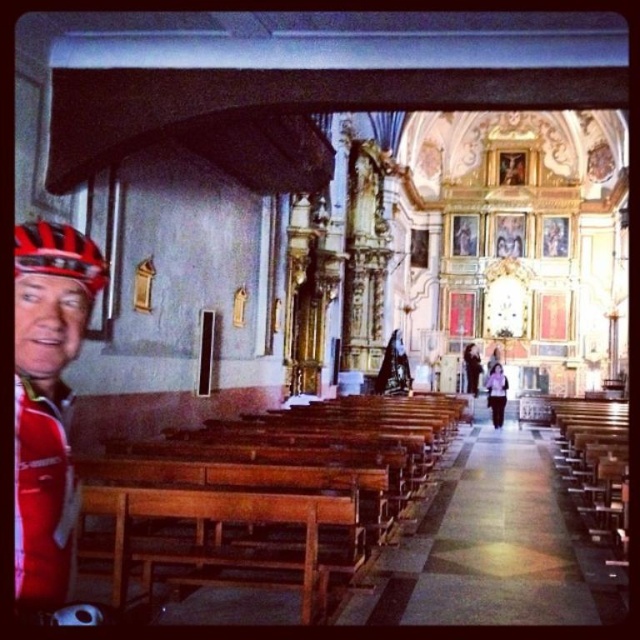
Question: Is wooden pews at center positioned at the back of red matte helmet at left?

Choices:
 (A) no
 (B) yes

Answer: (B)

Question: Observing the image, what is the correct spatial positioning of red matte helmet at left in reference to shiny red helmet at left?

Choices:
 (A) right
 (B) left

Answer: (B)

Question: Which object is the farthest from the red matte helmet at left?

Choices:
 (A) wooden pews at center
 (B) shiny red helmet at left
 (C) purple fabric at center
 (D) black leather jacket at center

Answer: (D)

Question: Which object appears farthest from the camera in this image?

Choices:
 (A) shiny red helmet at left
 (B) black leather jacket at center

Answer: (B)

Question: Does red matte helmet at left lie in front of shiny red helmet at left?

Choices:
 (A) no
 (B) yes

Answer: (B)

Question: Which point is farther to the camera?

Choices:
 (A) wooden pews at center
 (B) red matte helmet at left
 (C) black leather jacket at center

Answer: (C)